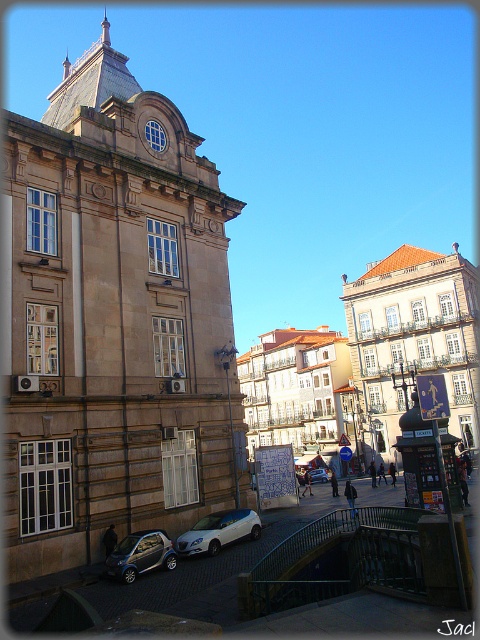
You are a pedestrian standing on the cobblestone street in front of the historic building. You want to cross the street to the other side. Which car, the white matte hatchback at center or the shiny silver car at lower left, is closer to you as you start crossing?

The white matte hatchback at center is closer to you because it is positioned further to the viewer than the shiny silver car at lower left, meaning it is nearer in your line of sight as you begin crossing the street.

You are a city planner analyzing the image. The brown stone building at center is a protected historic site. You need to ensure that any new construction near the shiny silver car at lower left does not exceed the building width. What should the maximum width of the new structure be?

The maximum width of the new structure should not exceed the width of the brown stone building at center, which is larger than the shiny silver car at lower left. Therefore, the new construction must be narrower than the brown stone building at center to comply with the historic preservation guidelines.

Based on the coordinates provided in the description, where is the brown stone building at center located in the image?

The brown stone building at center is located at coordinates point (113, 321).